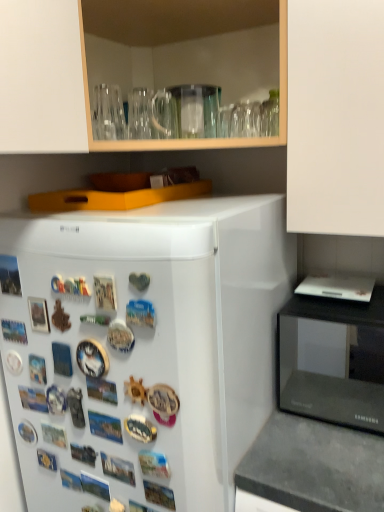
Question: From a real-world perspective, is dark gray concrete counter top at lower right physically below white glossy refrigerator at left?

Choices:
 (A) yes
 (B) no

Answer: (A)

Question: Considering the relative sizes of dark gray concrete counter top at lower right and white glossy refrigerator at left in the image provided, is dark gray concrete counter top at lower right smaller than white glossy refrigerator at left?

Choices:
 (A) no
 (B) yes

Answer: (B)

Question: Is dark gray concrete counter top at lower right directly adjacent to white glossy refrigerator at left?

Choices:
 (A) no
 (B) yes

Answer: (A)

Question: Is dark gray concrete counter top at lower right taller than white glossy refrigerator at left?

Choices:
 (A) yes
 (B) no

Answer: (B)

Question: From the image's perspective, would you say dark gray concrete counter top at lower right is shown under white glossy refrigerator at left?

Choices:
 (A) no
 (B) yes

Answer: (B)

Question: Considering the positions of white glossy refrigerator at left and dark gray concrete counter top at lower right in the image, is white glossy refrigerator at left taller or shorter than dark gray concrete counter top at lower right?

Choices:
 (A) tall
 (B) short

Answer: (A)

Question: From a real-world perspective, is white glossy refrigerator at left above or below dark gray concrete counter top at lower right?

Choices:
 (A) above
 (B) below

Answer: (A)

Question: Is point (105, 313) positioned closer to the camera than point (319, 494)?

Choices:
 (A) closer
 (B) farther

Answer: (B)

Question: From the image's perspective, is white glossy refrigerator at left positioned above or below dark gray concrete counter top at lower right?

Choices:
 (A) below
 (B) above

Answer: (B)

Question: Based on their positions, is black glossy microwave at right located to the left or right of dark gray concrete counter top at lower right?

Choices:
 (A) right
 (B) left

Answer: (A)

Question: Is black glossy microwave at right taller or shorter than dark gray concrete counter top at lower right?

Choices:
 (A) tall
 (B) short

Answer: (B)

Question: Considering the positions of black glossy microwave at right and dark gray concrete counter top at lower right in the image, is black glossy microwave at right wider or thinner than dark gray concrete counter top at lower right?

Choices:
 (A) wide
 (B) thin

Answer: (B)

Question: Is black glossy microwave at right bigger or smaller than dark gray concrete counter top at lower right?

Choices:
 (A) small
 (B) big

Answer: (A)

Question: From a real-world perspective, is black glossy microwave at right above or below white glossy refrigerator at left?

Choices:
 (A) above
 (B) below

Answer: (A)

Question: Considering the relative positions of black glossy microwave at right and white glossy refrigerator at left in the image provided, is black glossy microwave at right to the left or to the right of white glossy refrigerator at left?

Choices:
 (A) right
 (B) left

Answer: (A)